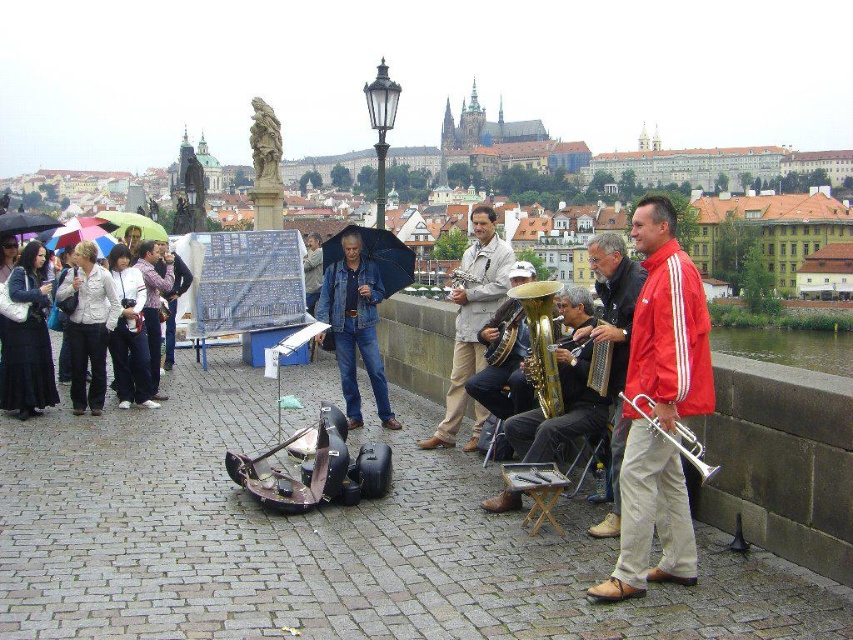
You are a photographer standing on the cobblestone bridge in Prague, aiming to capture a photo of the Prague Castle in the background. However, there is a light beige fabric jacket at center in the way. Can you move the jacket to the left to get a clear view of the castle?

The light beige fabric jacket at center is located at point (473, 316). Moving it to the left would depend on its current position relative to the castle view, but since the jacket is blocking the center, moving it left might help clear the view.